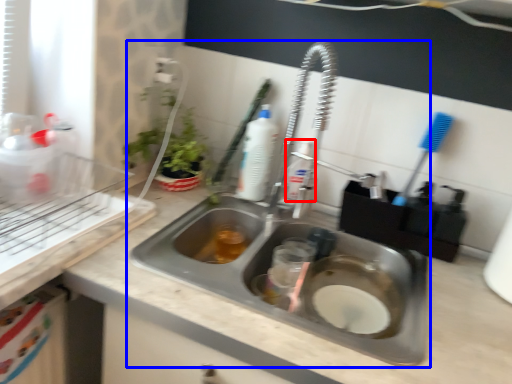
Question: Among these objects, which one is nearest to the camera, cleaning product (highlighted by a red box) or sink (highlighted by a blue box)?

Choices:
 (A) cleaning product
 (B) sink

Answer: (B)